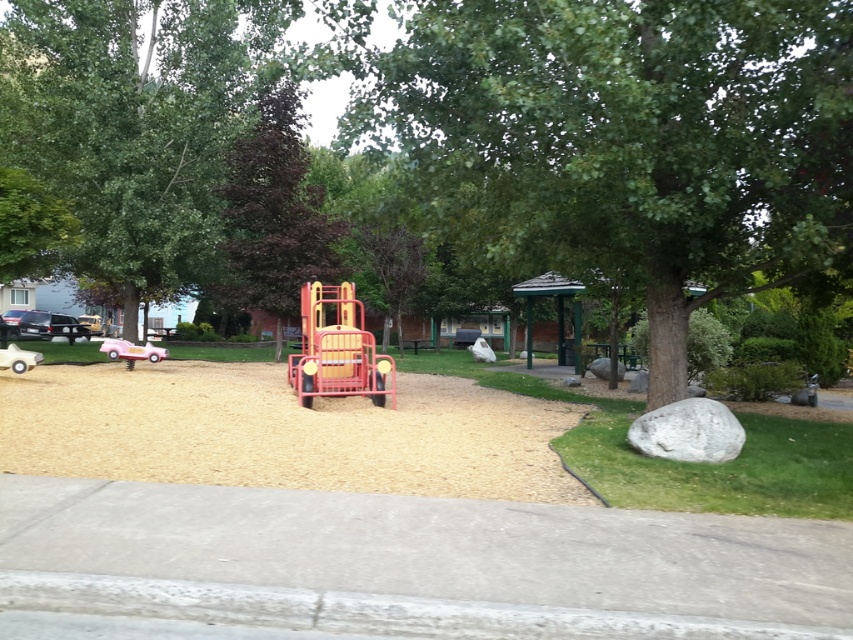
You are a child playing in the playground and you want to go from the pink plastic car at left to the green leafy tree at center. Which direction should you move in?

The green leafy tree at center is to the right of the pink plastic car at left, so you should move to the right to reach the green leafy tree at center from the pink plastic car at left.

You are a parent at the playground and want to choose a toy for your child. The metallic red play truck at center and the white rubber car at lower left are both available. Which one is larger in size?

The metallic red play truck at center is bigger than the white rubber car at lower left according to the description.

You are a parent supervising children at the playground. You see a metallic red play truck at center and a white rubber car at lower left. Which object is taller?

The metallic red play truck at center is taller than the white rubber car at lower left.